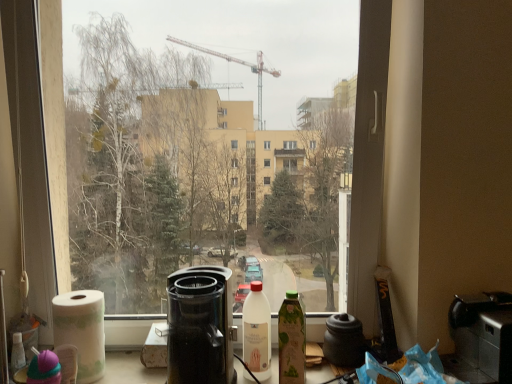
Question: Is the position of black plastic toaster at lower right, the 1th appliance in the right-to-left sequence, more distant than that of transparent glass window at center?

Choices:
 (A) no
 (B) yes

Answer: (A)

Question: From the image's perspective, is black plastic toaster at lower right, which appears as the second appliance when viewed from the left, on top of transparent glass window at center?

Choices:
 (A) no
 (B) yes

Answer: (A)

Question: Considering the relative sizes of black plastic toaster at lower right, which appears as the second appliance when viewed from the left, and transparent glass window at center in the image provided, is black plastic toaster at lower right, which appears as the second appliance when viewed from the left, wider than transparent glass window at center?

Choices:
 (A) yes
 (B) no

Answer: (B)

Question: From a real-world perspective, is black plastic toaster at lower right, which appears as the second appliance when viewed from the left, physically above transparent glass window at center?

Choices:
 (A) no
 (B) yes

Answer: (A)

Question: Does black plastic toaster at lower right, which appears as the second appliance when viewed from the left, have a lesser height compared to transparent glass window at center?

Choices:
 (A) no
 (B) yes

Answer: (B)

Question: Is black plastic toaster at lower right, the 1th appliance in the right-to-left sequence, turned away from transparent glass window at center?

Choices:
 (A) no
 (B) yes

Answer: (A)

Question: Are matte black coffeepot at center and white matte bottle at center, the 1th bottle viewed from the left, beside each other?

Choices:
 (A) yes
 (B) no

Answer: (B)

Question: Can you confirm if matte black coffeepot at center is wider than white matte bottle at center, which is the 2th bottle from right to left?

Choices:
 (A) yes
 (B) no

Answer: (B)

Question: Does matte black coffeepot at center have a smaller size compared to white matte bottle at center, which is the 2th bottle from right to left?

Choices:
 (A) yes
 (B) no

Answer: (A)

Question: Is matte black coffeepot at center positioned with its back to white matte bottle at center, which is the 2th bottle from right to left?

Choices:
 (A) no
 (B) yes

Answer: (A)

Question: Is matte black coffeepot at center bigger than white matte bottle at center, the 1th bottle viewed from the left?

Choices:
 (A) yes
 (B) no

Answer: (B)

Question: Does matte black coffeepot at center have a lesser width compared to white matte bottle at center, which is the 2th bottle from right to left?

Choices:
 (A) yes
 (B) no

Answer: (A)

Question: Can you confirm if transparent glass window at center is wider than green glass bottle at center, the second bottle in the left-to-right sequence?

Choices:
 (A) no
 (B) yes

Answer: (B)